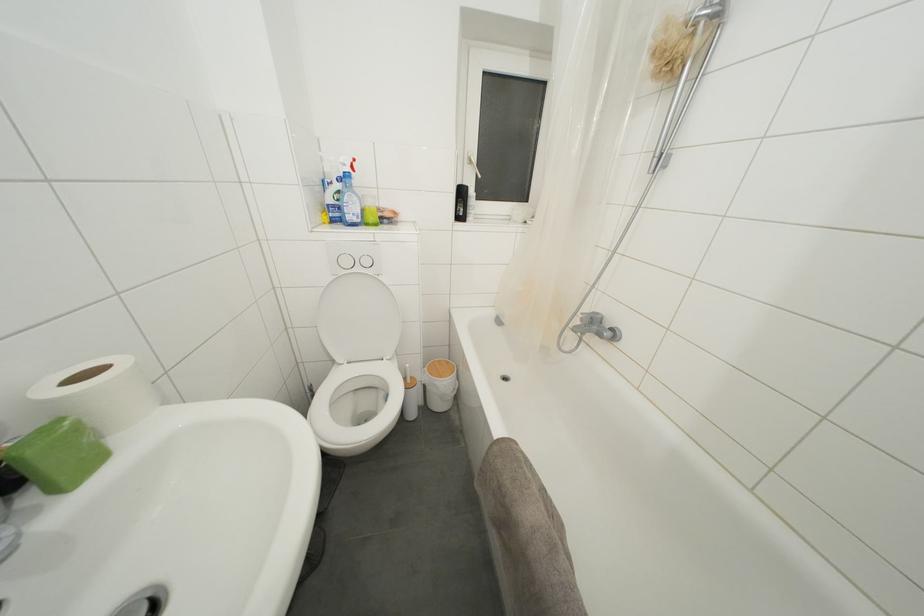
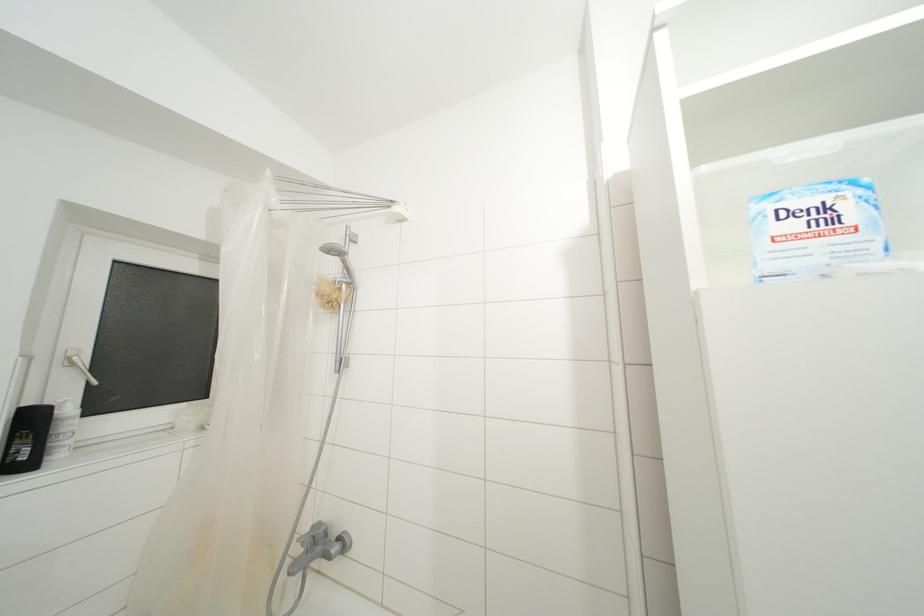
How did the camera likely rotate?

The camera rotated toward right-up.